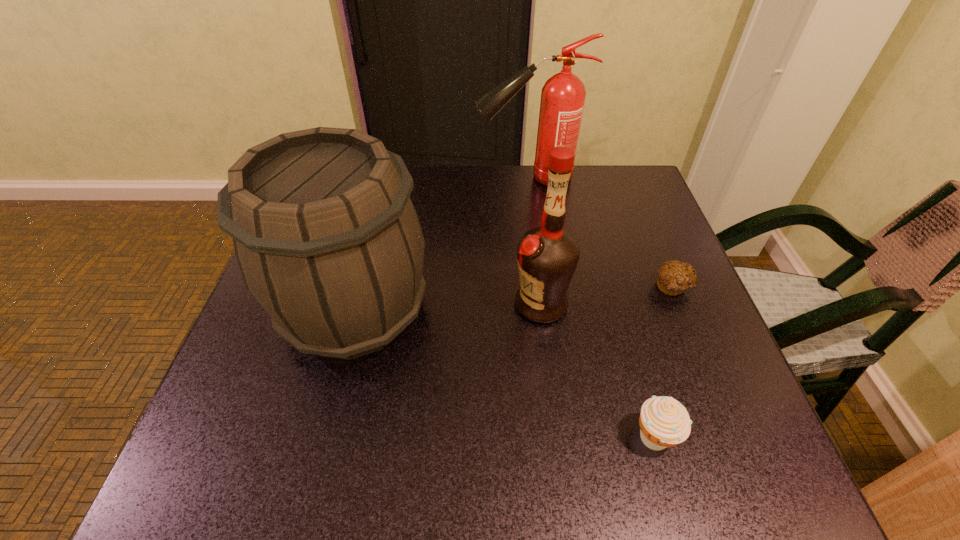
In order to click on vacant space situated 0.370m on the front and back of the liquor in this screenshot , I will do [334, 304].

Image resolution: width=960 pixels, height=540 pixels. I want to click on free region located on the front and back of the liquor, so click(x=445, y=304).

Where is `vacant position located on the front and back of the liquor`? vacant position located on the front and back of the liquor is located at coordinates (344, 304).

Locate an element on the screen. free region located on the back of the leftmost object is located at coordinates (377, 222).

The image size is (960, 540). I want to click on vacant region located on the back of the fourth tallest object, so click(x=619, y=314).

You are a GUI agent. You are given a task and a screenshot of the screen. Output one action in this format:
    pyautogui.click(x=<x>, y=<y>)
    Task: Click on the free space located 0.200m on the front of the shortest object
    The width and height of the screenshot is (960, 540).
    Given the screenshot: What is the action you would take?
    click(714, 387)

Locate an element on the screen. object positioned at the far edge is located at coordinates (563, 96).

At what (x,y) coordinates should I click in order to perform the action: click on object present at the near edge. Please return your answer as a coordinate pair (x, y). The height and width of the screenshot is (540, 960). Looking at the image, I should click on (664, 422).

Where is `object present at the left edge`? Image resolution: width=960 pixels, height=540 pixels. object present at the left edge is located at coordinates (327, 239).

This screenshot has height=540, width=960. In order to click on object at the near right corner in this screenshot , I will do (664, 422).